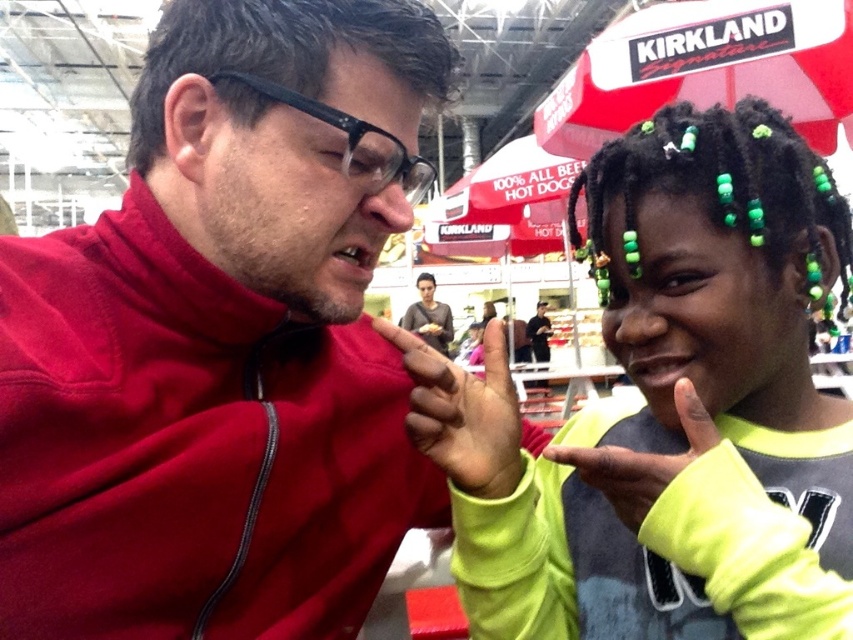
Question: Which of the following is the closest to the observer?

Choices:
 (A) coord(671,460)
 (B) coord(450,323)
 (C) coord(846,544)

Answer: (A)

Question: Is neon green sweater at center above matte red hand at center?

Choices:
 (A) no
 (B) yes

Answer: (B)

Question: Is matte red jacket at center closer to camera compared to matte red hand at center?

Choices:
 (A) yes
 (B) no

Answer: (A)

Question: Estimate the real-world distances between objects in this image. Which object is farther from the matte red jacket at center?

Choices:
 (A) green matte hand at center
 (B) matte red hand at center

Answer: (A)

Question: Can you confirm if matte red jacket at center is positioned to the left of green matte hand at center?

Choices:
 (A) yes
 (B) no

Answer: (A)

Question: Which of the following is the farthest from the observer?

Choices:
 (A) (662, 467)
 (B) (659, 358)

Answer: (B)